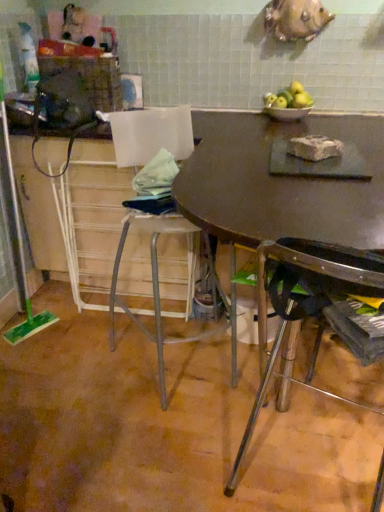
Question: In the image, is matte brown table at center on the left side or the right side of dark brown wood table at center?

Choices:
 (A) right
 (B) left

Answer: (A)

Question: From a real-world perspective, is matte brown table at center positioned above or below dark brown wood table at center?

Choices:
 (A) above
 (B) below

Answer: (A)

Question: Considering the real-world distances, which object is closest to the matte brown table at center?

Choices:
 (A) white crumbly block at center
 (B) metallic silver stool at center, marked as the first chair in a left-to-right arrangement
 (C) dark brown wood table at center
 (D) metallic silver chair at lower right, marked as the 1th chair in a right-to-left arrangement
 (E) green matte apples at upper center

Answer: (C)

Question: Which is nearer to the green plastic screen door at left?

Choices:
 (A) metallic silver chair at lower right, marked as the 1th chair in a right-to-left arrangement
 (B) matte brown table at center
 (C) green matte apples at upper center
 (D) metallic silver stool at center, which ranks as the second chair in right-to-left order
 (E) white crumbly block at center

Answer: (D)